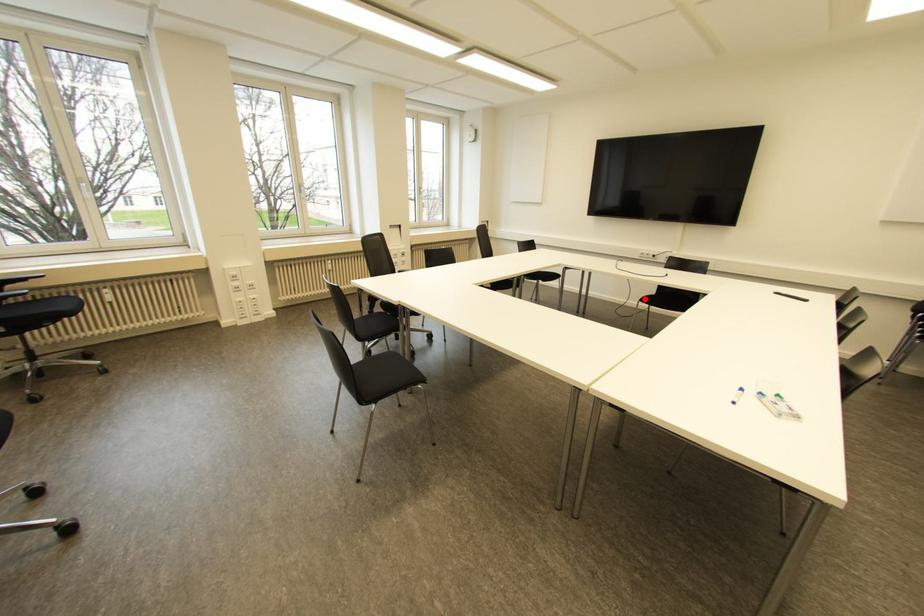
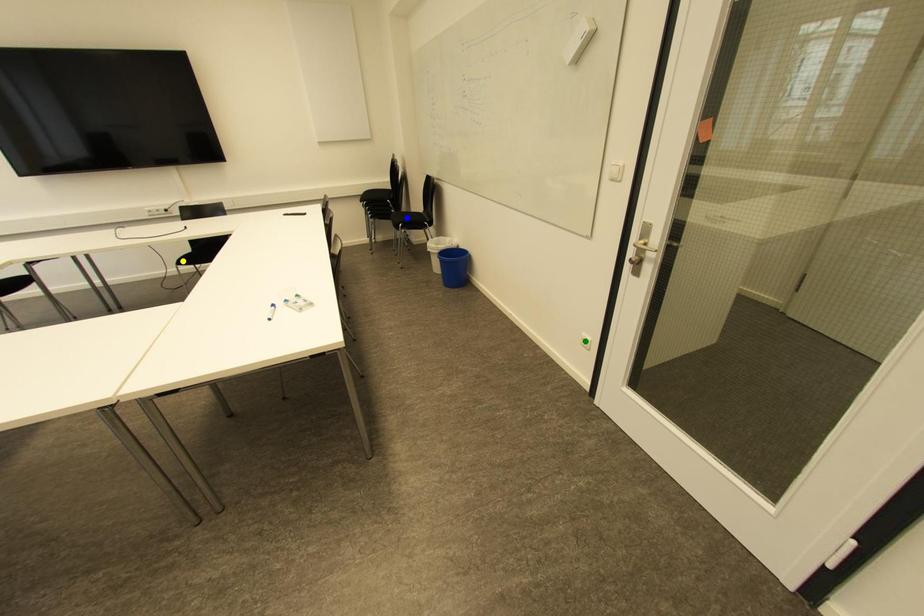
Question: I am providing you with two images of the same scene from different viewpoints. A red point is marked on the first image. You are given multiple points on the second image. In image 2, which mark is for the same physical point as the one in image 1?

Choices:
 (A) blue point
 (B) green point
 (C) yellow point

Answer: (C)